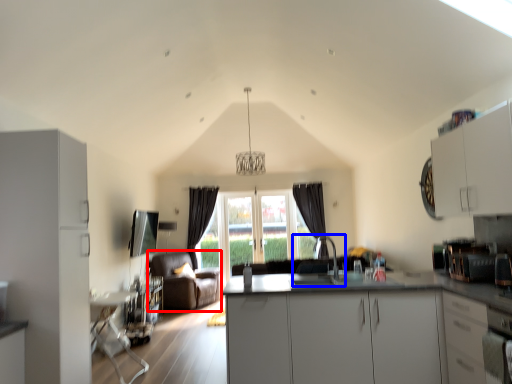
Question: Which object appears closest to the camera in this image, armchair (highlighted by a red box) or sink (highlighted by a blue box)?

Choices:
 (A) armchair
 (B) sink

Answer: (B)